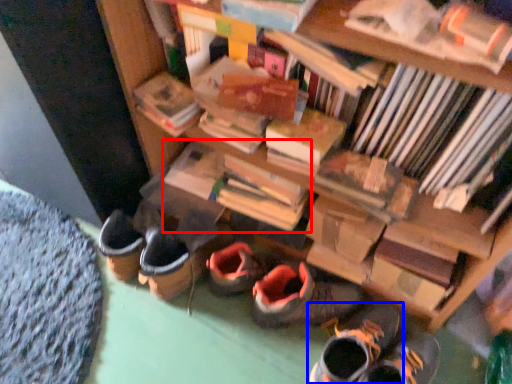
Question: Which point is closer to the camera, book (highlighted by a red box) or footwear (highlighted by a blue box)?

Choices:
 (A) book
 (B) footwear

Answer: (B)